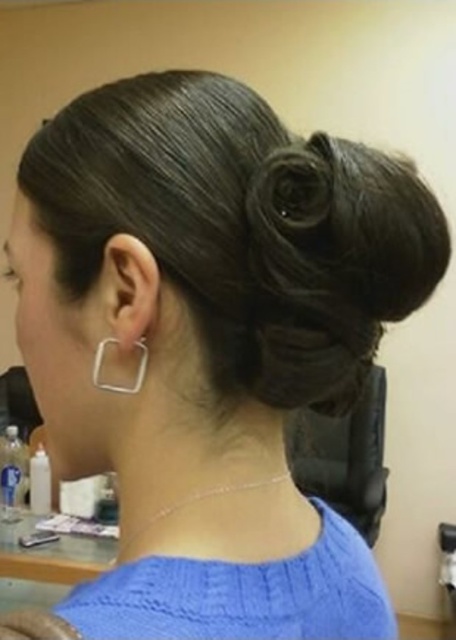
Looking at this image, you are a stylist observing a client with dark brown hair at upper center and a silver metallic square at lower left. Which object is positioned to the right side of the other?

The dark brown hair at upper center is to the left of the silver metallic square at lower left, meaning the silver metallic square at lower left is positioned to the right side of the dark brown hair at upper center.

You are a photographer taking a portrait of this person. You want to focus on the point at point (48, 627) and point (144, 362). Which point should you focus on first to ensure it appears sharp in the photo?

Point (48, 627) is in front of point (144, 362), so you should focus on point (48, 627) first to ensure it appears sharp in the photo.